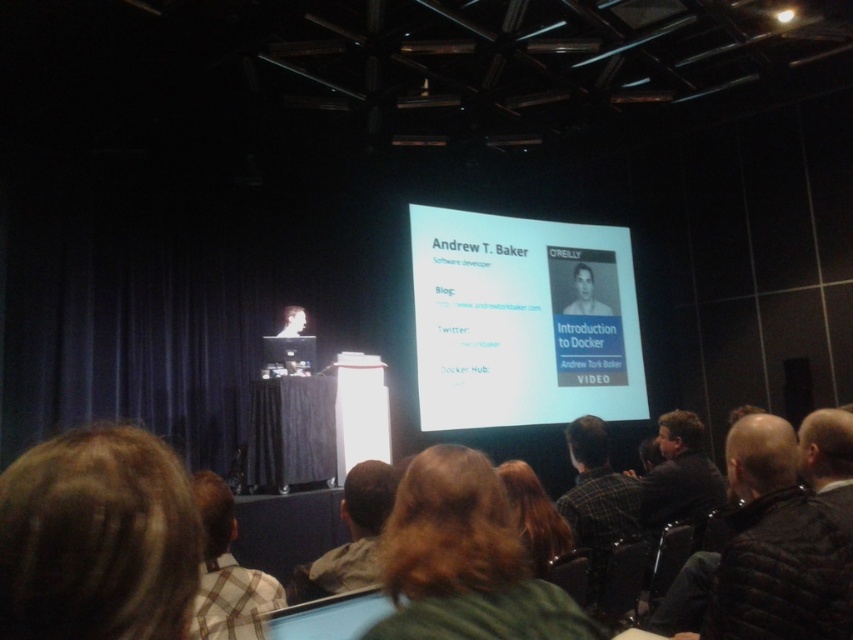
Which is more to the left, plaid shirt at lower left or plaid shirt at lower center?

From the viewer's perspective, plaid shirt at lower left appears more on the left side.

Which is below, plaid shirt at lower left or plaid shirt at lower center?

plaid shirt at lower center is lower down.

Who is more distant from viewer, (206, 518) or (576, 456)?

The point (576, 456) is more distant.

The width and height of the screenshot is (853, 640). In order to click on plaid shirt at lower left in this screenshot , I will do `click(227, 572)`.

Who is higher up, plaid shirt at lower left or dark brown leather jacket at lower right?

plaid shirt at lower left

Which of these two, plaid shirt at lower left or dark brown leather jacket at lower right, stands taller?

Standing taller between the two is plaid shirt at lower left.

This screenshot has height=640, width=853. Find the location of `plaid shirt at lower left`. plaid shirt at lower left is located at coordinates (227, 572).

In order to click on plaid shirt at lower left in this screenshot , I will do `click(227, 572)`.

Between plaid shirt at lower center and light blue shirt at upper center, which one appears on the right side from the viewer's perspective?

Positioned to the right is light blue shirt at upper center.

Between plaid shirt at lower center and light blue shirt at upper center, which one has less height?

plaid shirt at lower center is shorter.

This screenshot has height=640, width=853. Describe the element at coordinates (596, 490) in the screenshot. I see `plaid shirt at lower center` at that location.

Locate an element on the screen. This screenshot has height=640, width=853. plaid shirt at lower center is located at coordinates (596, 490).